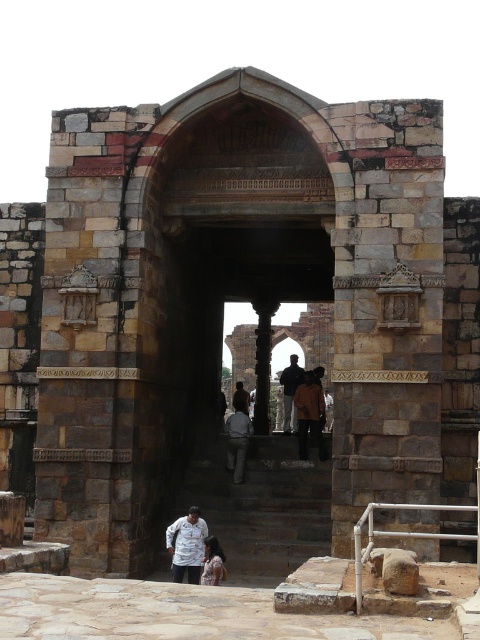
Question: Among these points, which one is nearest to the camera?

Choices:
 (A) (280, 381)
 (B) (222, 497)
 (C) (240, 401)
 (D) (182, 561)

Answer: (D)

Question: In this image, where is orange fabric pants at center located relative to dark blue jeans at center?

Choices:
 (A) below
 (B) above

Answer: (A)

Question: Can you confirm if orange fabric pants at center is positioned below light gray fabric pants at center?

Choices:
 (A) no
 (B) yes

Answer: (A)

Question: Is light brown fabric shirt at center wider than dark brown leather jacket at center?

Choices:
 (A) yes
 (B) no

Answer: (B)

Question: Which point is farther from the camera taking this photo?

Choices:
 (A) (313, 420)
 (B) (180, 550)

Answer: (A)

Question: Which of these objects is positioned farthest from the orange fabric pants at center?

Choices:
 (A) dark blue jeans at center
 (B) dark brown leather jacket at center
 (C) light brown fabric shirt at center
 (D) brown stone stairs at center

Answer: (C)